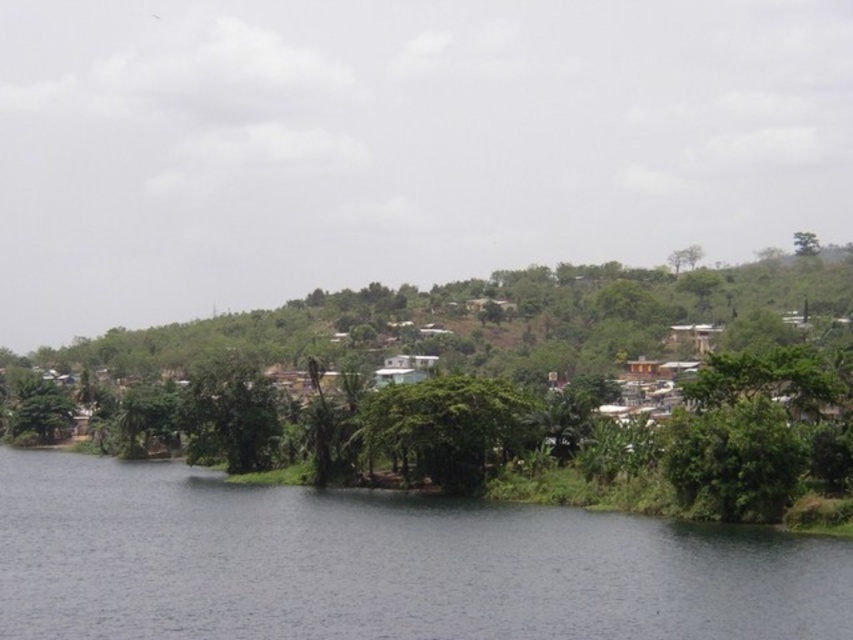
You are standing at the center of the image and want to locate the dark gray water at center. What are the coordinates where you should look?

The dark gray water at center is located at coordinates point (380, 564).

You are standing at the riverside and want to throw a pebble into the dark gray water at center. Considering the distance, can you estimate whether a typical adult human can accurately throw a pebble that far?

The dark gray water at center is 47.38 meters away from the viewer. A typical adult human can throw a pebble about 20 to 30 meters on average, so it would be difficult to accurately throw a pebble that far.